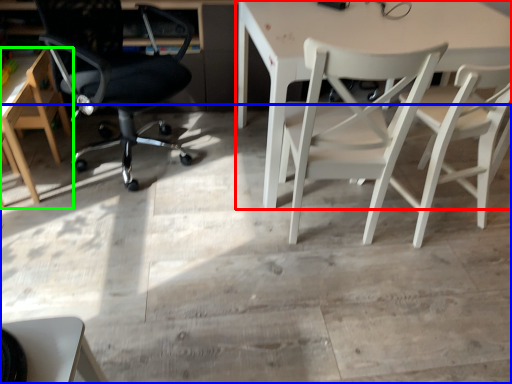
Question: Which is farther away from table (highlighted by a red box)? concrete (highlighted by a blue box) or chair (highlighted by a green box)?

Choices:
 (A) concrete
 (B) chair

Answer: (B)